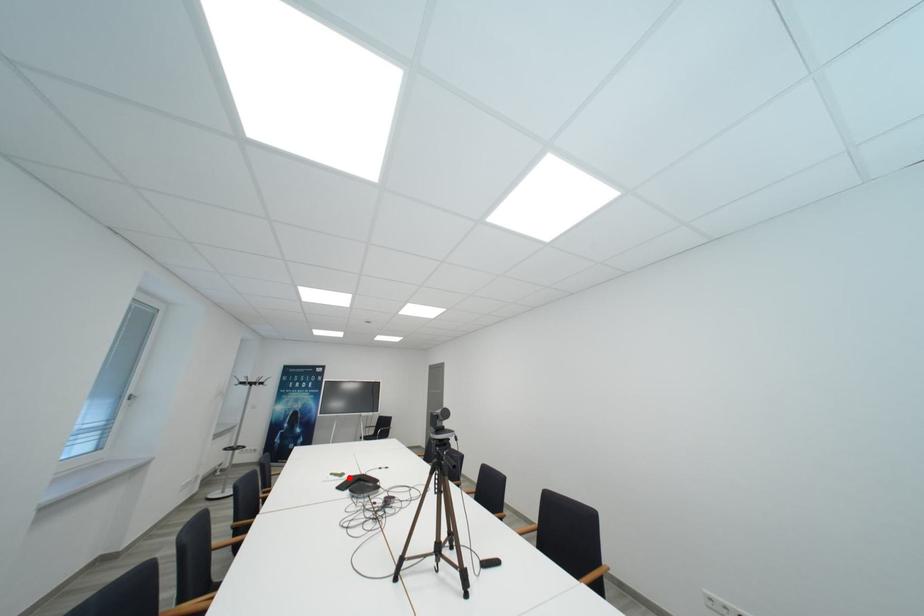
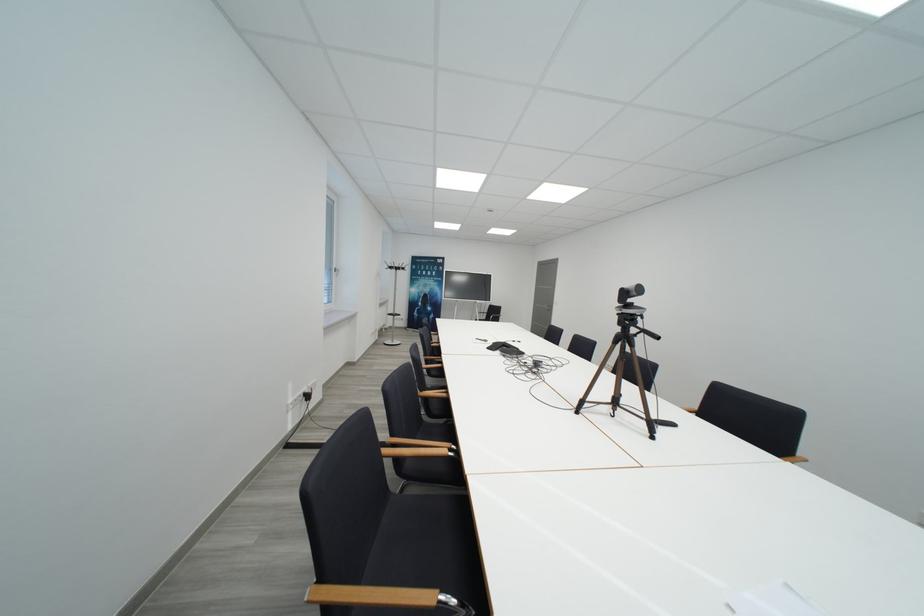
In the second image, find the point that corresponds to the highlighted location in the first image.

(492, 344)